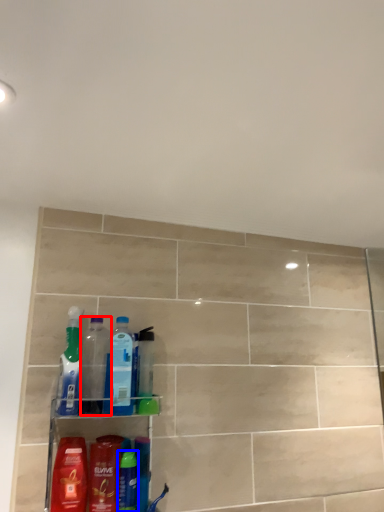
Question: Which of the following is the closest to the observer, bottle (highlighted by a red box) or toiletry (highlighted by a blue box)?

Choices:
 (A) bottle
 (B) toiletry

Answer: (B)